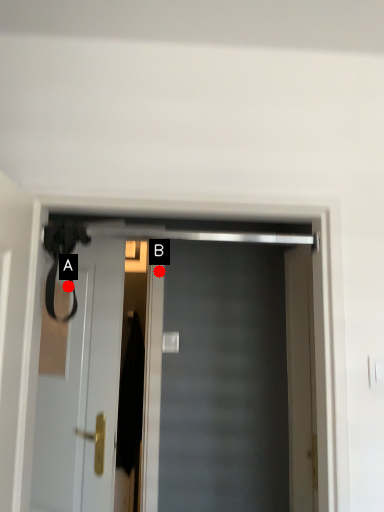
Question: Two points are circled on the image, labeled by A and B beside each circle. Which point is closer to the camera?

Choices:
 (A) A is closer
 (B) B is closer

Answer: (A)